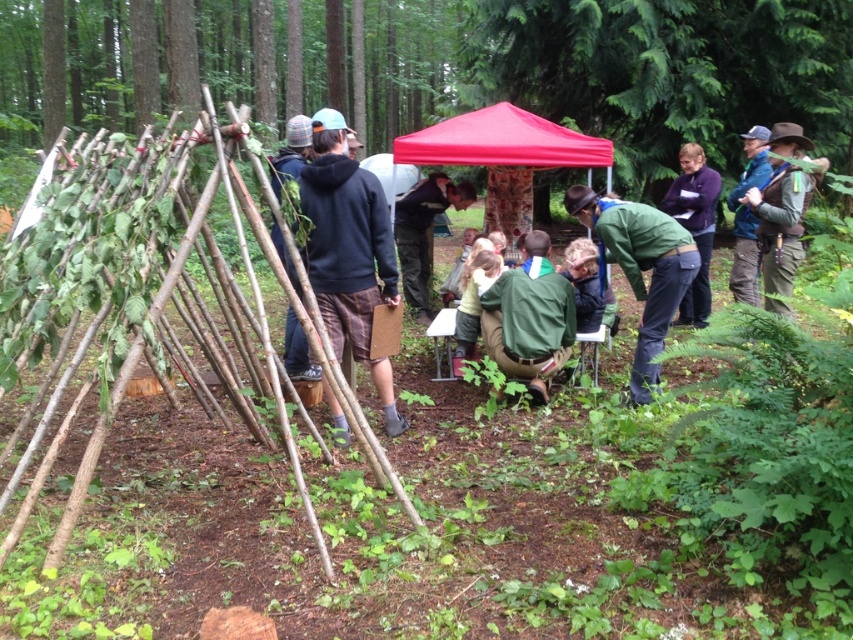
Can you confirm if brown leather hat at upper right is positioned above dark purple sweater at center?

Indeed, brown leather hat at upper right is positioned over dark purple sweater at center.

Does brown leather hat at upper right appear under dark purple sweater at center?

Incorrect, brown leather hat at upper right is not positioned below dark purple sweater at center.

Find the location of `brown leather hat at upper right`. brown leather hat at upper right is located at coordinates (782, 205).

Which is behind, point (787, 205) or point (310, 374)?

The point (310, 374) is behind.

Is brown leather hat at upper right further to the viewer compared to dark blue sweater at center?

No, brown leather hat at upper right is closer to the viewer.

The image size is (853, 640). What are the coordinates of `brown leather hat at upper right` in the screenshot? It's located at (782, 205).

Can you confirm if dark blue hoodie at center is positioned to the left of red fabric tent at center?

Correct, you'll find dark blue hoodie at center to the left of red fabric tent at center.

Between dark blue hoodie at center and red fabric tent at center, which one appears on the right side from the viewer's perspective?

red fabric tent at center is more to the right.

Which is behind, point (360, 339) or point (521, 134)?

Point (521, 134)

The width and height of the screenshot is (853, 640). Identify the location of dark blue hoodie at center. (349, 252).